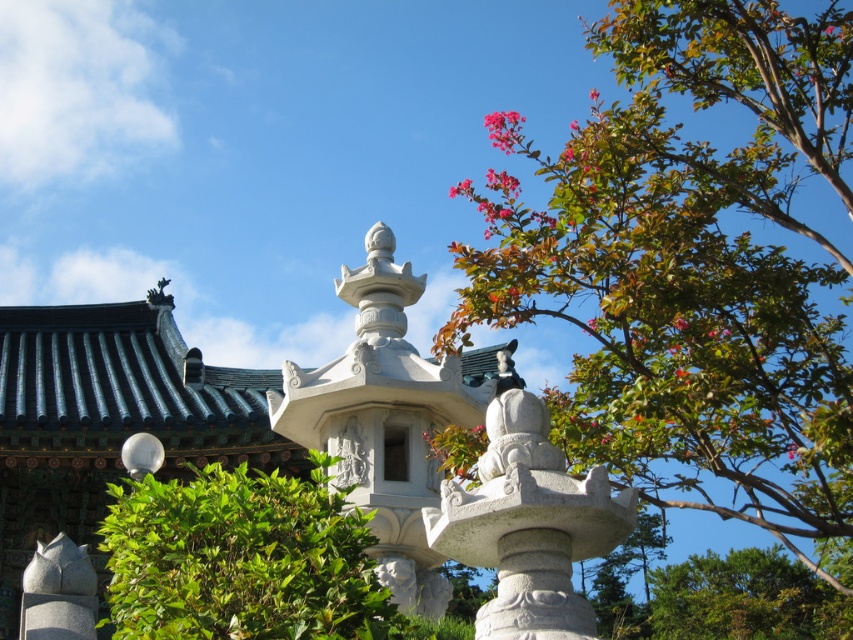
You are standing in the garden and want to take a photo of both the white stone lantern at center and the pink matte flower at upper right. Which object should you focus on first to ensure both are in the frame?

You should focus on the white stone lantern at center first because it is closer to the viewer than the pink matte flower at upper right, so adjusting the camera to include both would require starting with the closer object.

You are standing in the outdoor scene and want to find the white stone lantern at center. Based on the coordinates provided, in which direction relative to your current position should you move to locate it?

The white stone lantern at center is located at coordinates approximately 0.655 on the x axis and 0.454 on the y axis. Since you are currently at the origin point, you should move towards the right and slightly forward to reach it.

You are standing at the entrance of the garden and want to know the distance between the green leafy hedge at center and the white stone statue at center. Can you estimate how far apart they are?

The green leafy hedge at center is 63.52 feet away from the white stone statue at center.